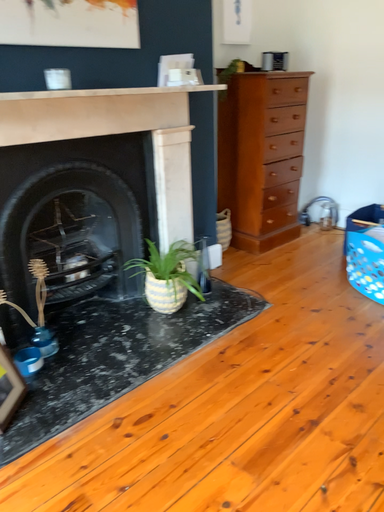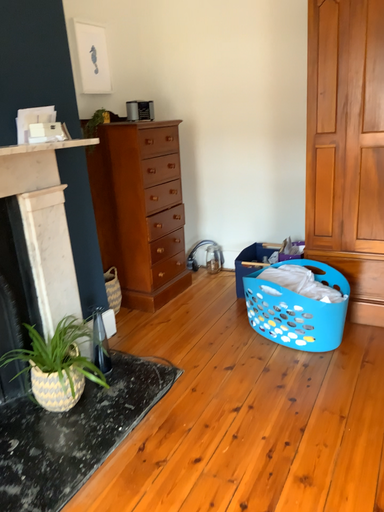
Question: How did the camera likely rotate when shooting the video?

Choices:
 (A) rotated left
 (B) rotated right

Answer: (B)